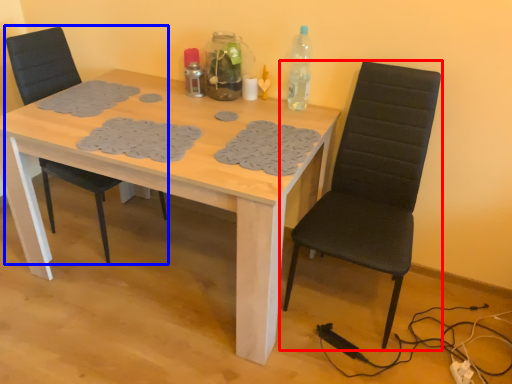
Question: Which point is closer to the camera, chair (highlighted by a red box) or chair (highlighted by a blue box)?

Choices:
 (A) chair
 (B) chair

Answer: (A)